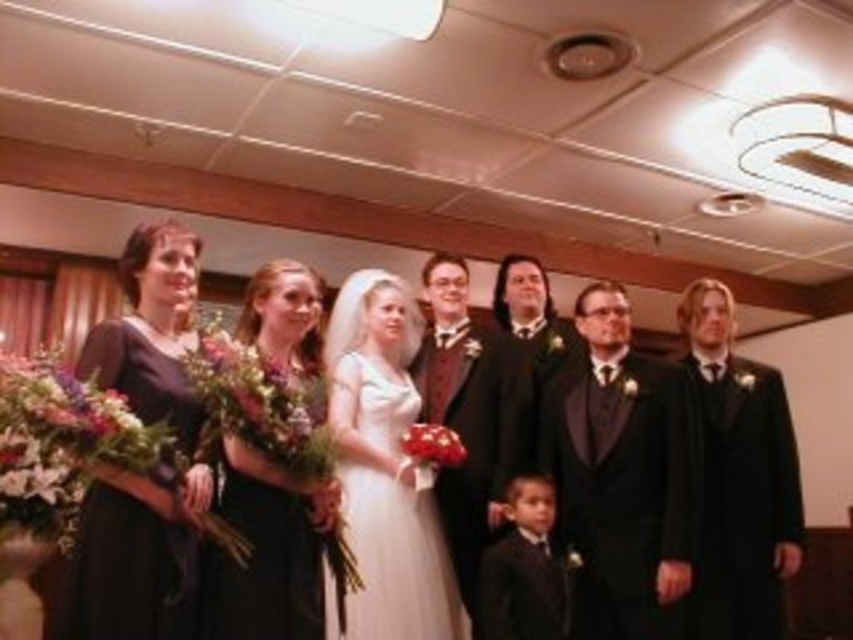
Based on the photo, in the formal group portrait, you notice two types of dresses among the bridesmaids. The first is a black satin dress at center, and the second are matte black dresses at left. Which of these dresses is positioned lower in the image?

The black satin dress at center is positioned lower than the matte black dresses at left.

You are a photographer adjusting camera settings for the group portrait. The shiny black suit at center and the matte black suit at center are both in focus. Which one appears larger in the photo due to their height difference?

The shiny black suit at center appears larger in the photo because it is taller than the matte black suit at center.